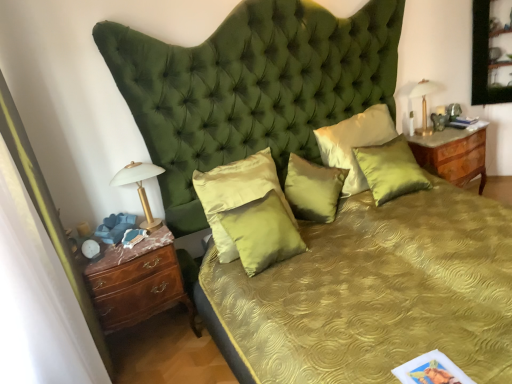
At what (x,y) coordinates should I click in order to perform the action: click on free area below gold metallic lamp at upper right, marked as the first bedside lamp in a back-to-front arrangement (from a real-world perspective). Please return your answer as a coordinate pair (x, y). Looking at the image, I should click on (420, 133).